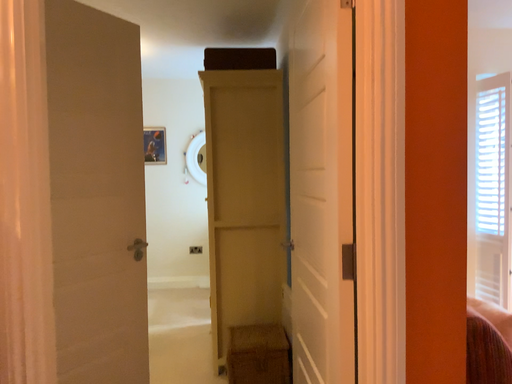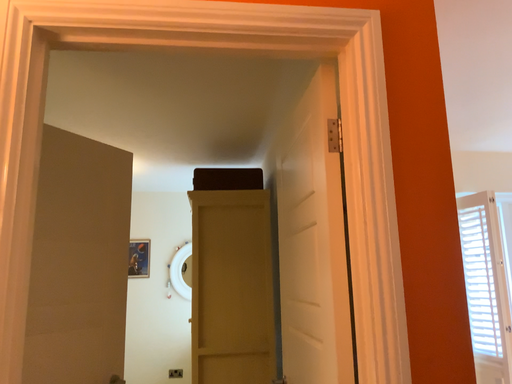
Question: Which way did the camera rotate in the video?

Choices:
 (A) rotated upward
 (B) rotated downward

Answer: (A)